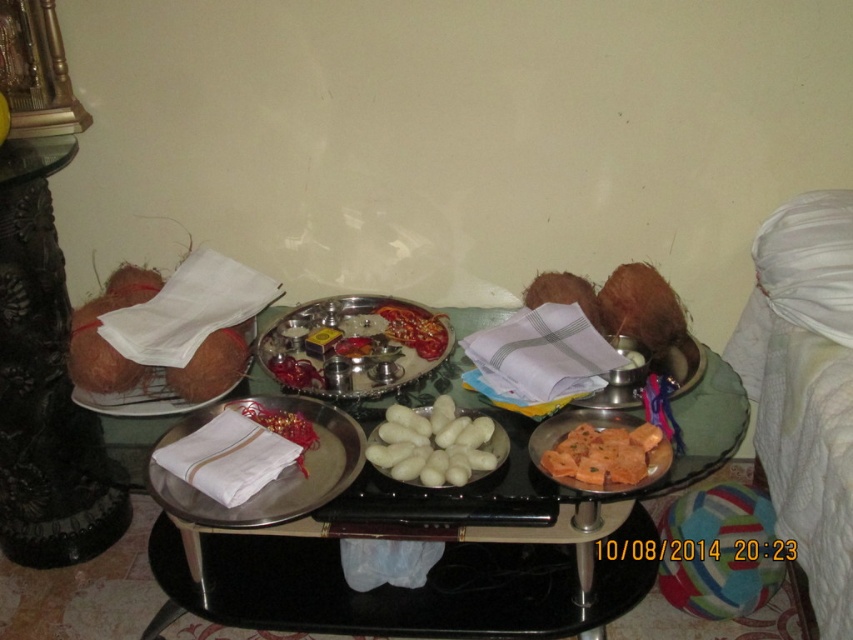
Question: Is metallic silver tray at center positioned at the back of silver metallic tray at center?

Choices:
 (A) yes
 (B) no

Answer: (B)

Question: Is orange matte fried snack at center to the right of coconut shell at left from the viewer's perspective?

Choices:
 (A) no
 (B) yes

Answer: (B)

Question: Among these points, which one is farthest from the camera?

Choices:
 (A) (432, 586)
 (B) (398, 426)

Answer: (A)

Question: Which point is closer to the camera?

Choices:
 (A) white cloth napkin at center
 (B) coconut shell at left

Answer: (A)

Question: Which object is positioned farthest from the white matte food at center?

Choices:
 (A) metallic silver tray at center
 (B) coconut shell at left

Answer: (B)

Question: Does metallic silver tray at center have a lesser width compared to silver metallic tray at center?

Choices:
 (A) yes
 (B) no

Answer: (B)